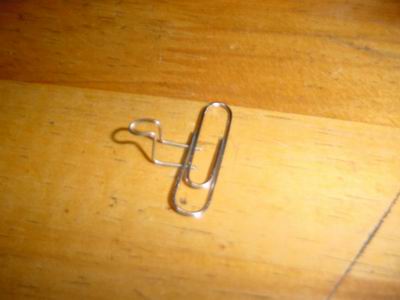
This screenshot has width=400, height=300. Identify the location of wooden surface. (289, 197), (300, 83), (376, 247).